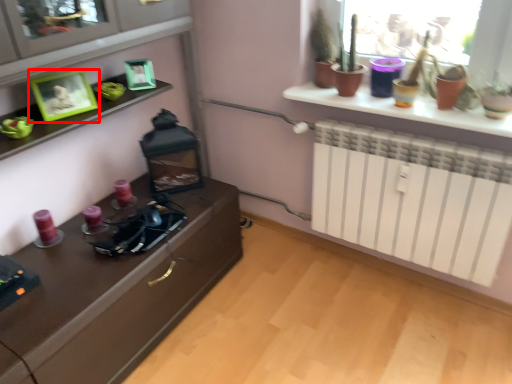
Question: Considering the relative positions of picture frame (annotated by the red box) and picture frame in the image provided, where is picture frame (annotated by the red box) located with respect to the staircase?

Choices:
 (A) right
 (B) left

Answer: (B)